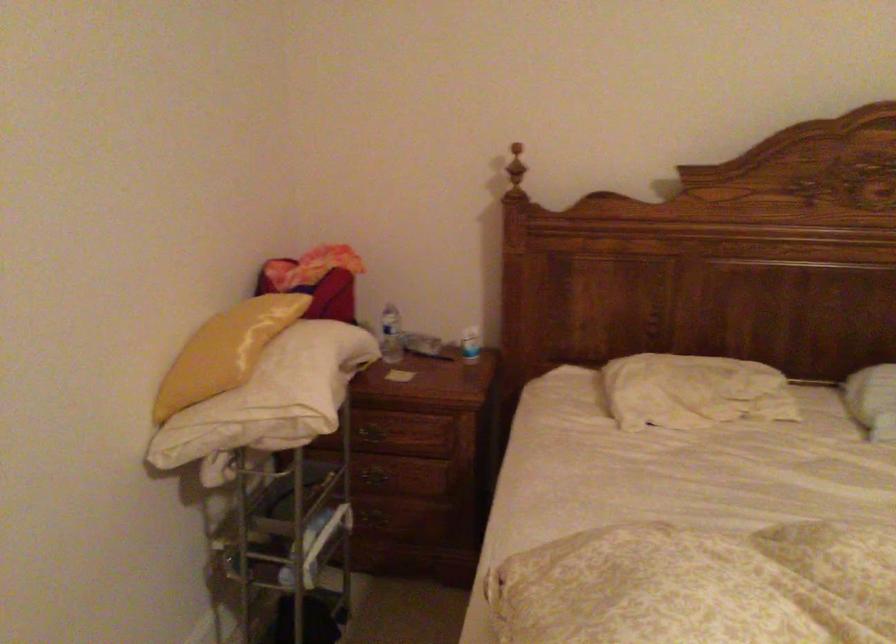
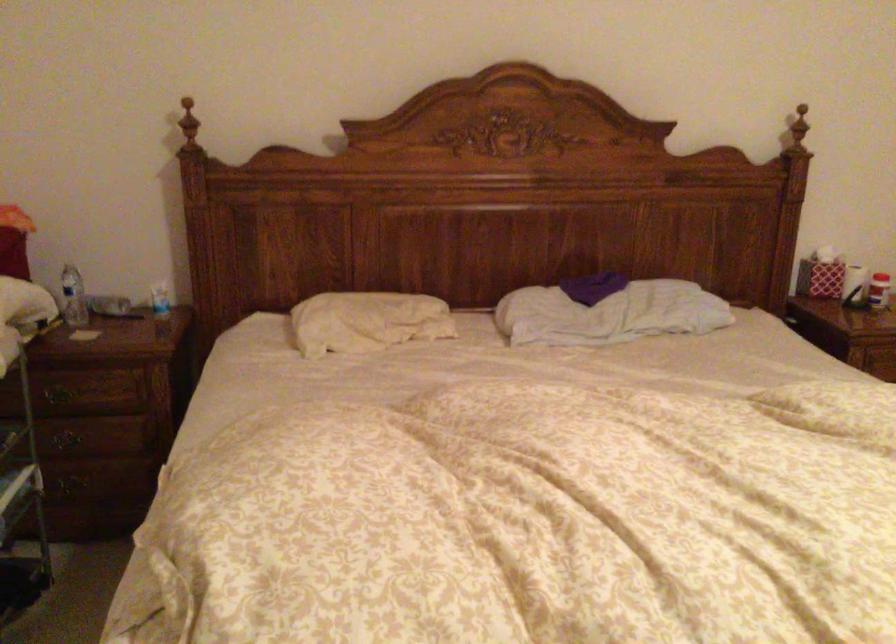
What movement of the cameraman would produce the second image?

The cameraman walked toward right, backward.